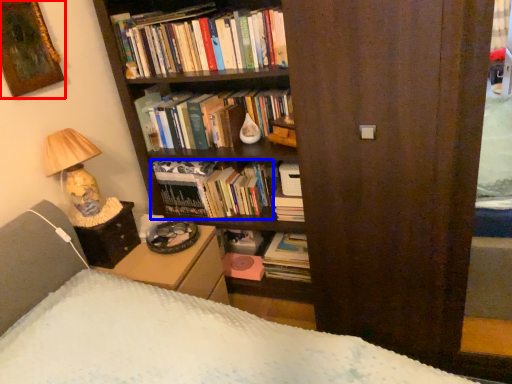
Question: Which object is closer to the camera taking this photo, picture frame (highlighted by a red box) or book (highlighted by a blue box)?

Choices:
 (A) picture frame
 (B) book

Answer: (A)